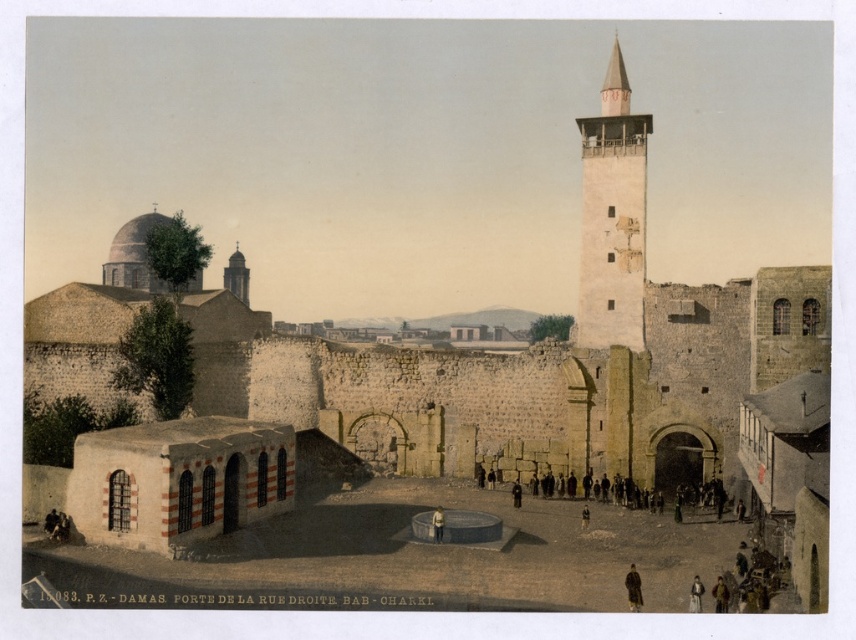
Question: Is white stone tower at upper right to the left of smooth stone minaret at upper left from the viewer's perspective?

Choices:
 (A) yes
 (B) no

Answer: (B)

Question: Among these points, which one is nearest to the camera?

Choices:
 (A) (699, 582)
 (B) (591, 145)
 (C) (229, 276)
 (D) (441, 536)

Answer: (A)

Question: Is smooth stone minaret at upper left smaller than brown leather jacket at lower right?

Choices:
 (A) no
 (B) yes

Answer: (A)

Question: Which is farther from the brown leather jacket at lower right?

Choices:
 (A) smooth stone minaret at upper left
 (B) light brown leather jacket at center

Answer: (A)

Question: Estimate the real-world distances between objects in this image. Which object is closer to the smooth stone minaret at upper left?

Choices:
 (A) light brown leather jacket at center
 (B) brown fur coat at lower right

Answer: (A)

Question: Can you confirm if white stone tower at upper right is thinner than brown leather jacket at lower right?

Choices:
 (A) no
 (B) yes

Answer: (A)